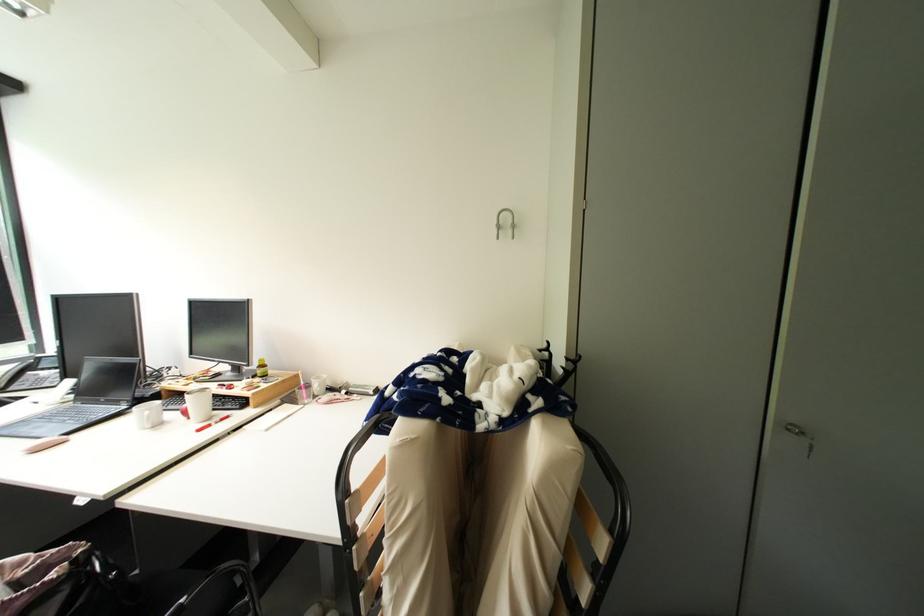
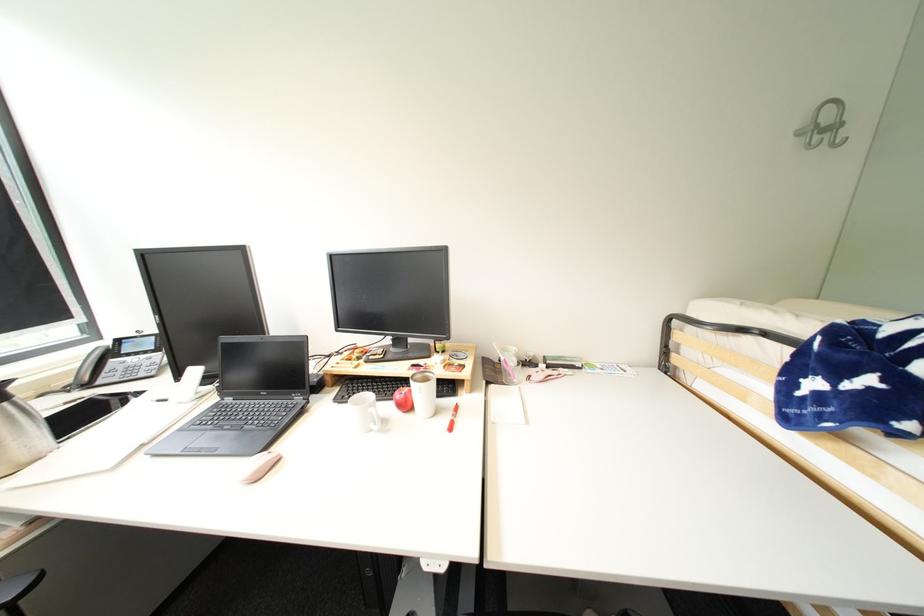
Question: The images are taken continuously from a first-person perspective. In which direction are you moving?

Choices:
 (A) Left
 (B) Right
 (C) Forward
 (D) Backward

Answer: (A)